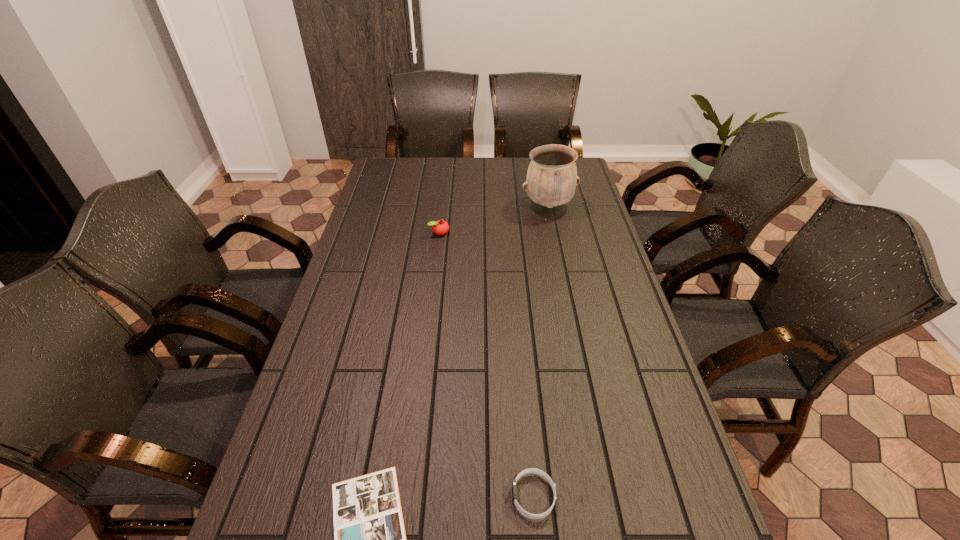
Point out which object is positioned as the nearest to the apple. Please provide its 2D coordinates. Your answer should be formatted as a tuple, i.e. [(x, y)], where the tuple contains the x and y coordinates of a point satisfying the conditions above.

[(551, 181)]

You are a GUI agent. You are given a task and a screenshot of the screen. Output one action in this format:
    pyautogui.click(x=<x>, y=<y>)
    Task: Click on the object that is the second closest to the third shortest object
    
    Given the screenshot: What is the action you would take?
    tap(369, 535)